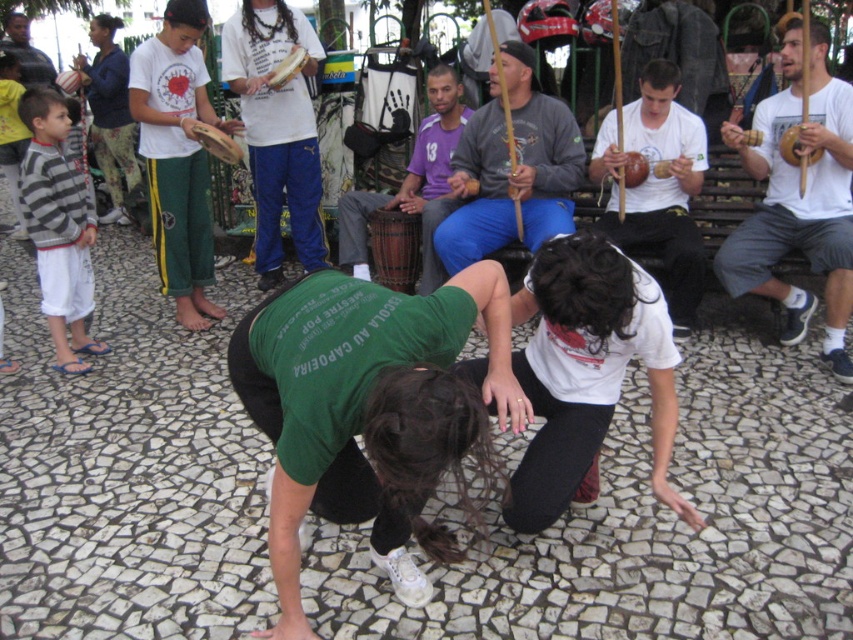
Question: Is white cotton shirt at upper left wider than white matte drum at upper center?

Choices:
 (A) no
 (B) yes

Answer: (A)

Question: In this image, where is striped sweater at left located relative to matte green shirt at center?

Choices:
 (A) below
 (B) above

Answer: (A)

Question: Which object appears farthest from the camera in this image?

Choices:
 (A) white cotton shirt at upper left
 (B) striped sweater at left
 (C) white matte coconut shell at center

Answer: (A)

Question: Which point is farther from the camera taking this photo?

Choices:
 (A) (683, 138)
 (B) (160, 225)

Answer: (B)

Question: Estimate the real-world distances between objects in this image. Which object is farther from the green fabric squat at center?

Choices:
 (A) white matte shirt at center
 (B) white cotton shirt at upper left

Answer: (B)

Question: Does white matte drum at right have a smaller size compared to matte green shirt at center?

Choices:
 (A) yes
 (B) no

Answer: (B)